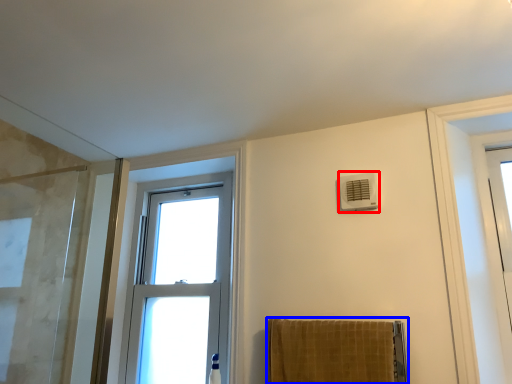
Question: Which object appears farthest to the camera in this image, air conditioning (highlighted by a red box) or towel (highlighted by a blue box)?

Choices:
 (A) air conditioning
 (B) towel

Answer: (A)